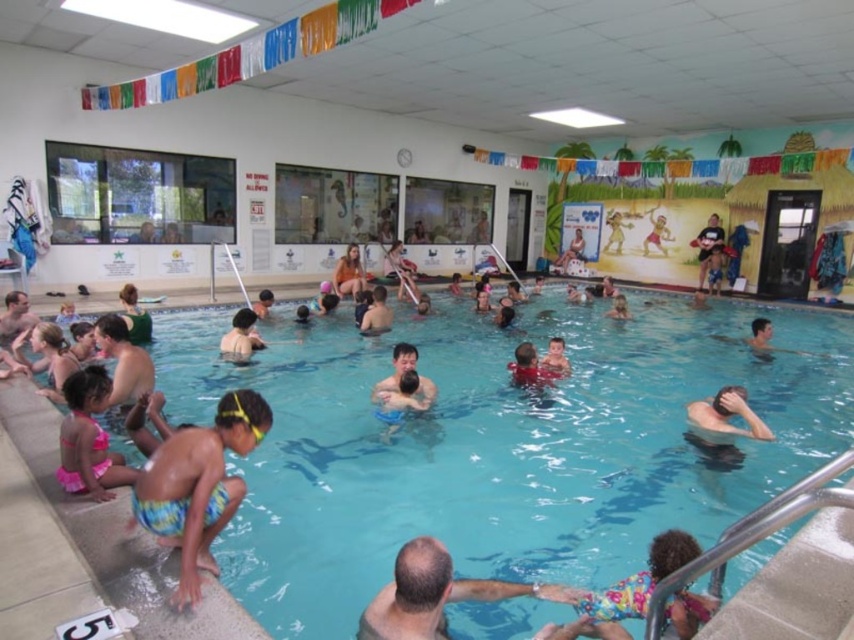
Question: Among these objects, which one is farthest from the camera?

Choices:
 (A) multicolored swimsuit at lower right
 (B) pink fabric swimsuit at lower left

Answer: (B)

Question: Considering the relative positions of smooth skin man at lower center and pink fabric swimsuit at lower left in the image provided, where is smooth skin man at lower center located with respect to pink fabric swimsuit at lower left?

Choices:
 (A) right
 (B) left

Answer: (A)

Question: Which object is the farthest from the multicolored swimsuit at lower right?

Choices:
 (A) smooth skin man at lower center
 (B) matte skin at center

Answer: (B)

Question: Which point is farther to the camera?

Choices:
 (A) blue tie-dye swim trunks at lower left
 (B) multicolored swimsuit at lower right
 (C) smooth skin man at lower center

Answer: (A)

Question: Can you confirm if multicolored swimsuit at lower right is wider than matte skin at center?

Choices:
 (A) no
 (B) yes

Answer: (B)

Question: Is blue tie-dye swim trunks at lower left bigger than matte skin at center?

Choices:
 (A) no
 (B) yes

Answer: (B)